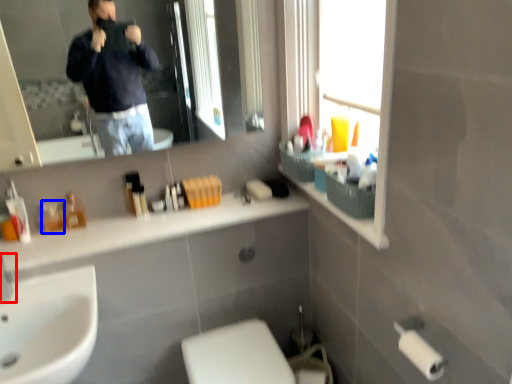
Question: Which object appears farthest to the camera in this image, faucet (highlighted by a red box) or toiletry (highlighted by a blue box)?

Choices:
 (A) faucet
 (B) toiletry

Answer: (B)